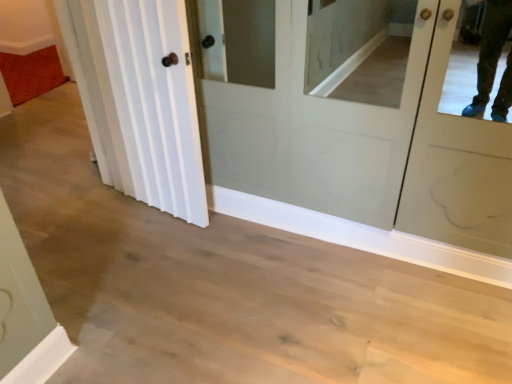
The height and width of the screenshot is (384, 512). What do you see at coordinates (155, 103) in the screenshot? I see `white striped curtain at left` at bounding box center [155, 103].

This screenshot has height=384, width=512. In order to click on white striped curtain at left in this screenshot , I will do `click(155, 103)`.

Locate an element on the screen. The height and width of the screenshot is (384, 512). white striped curtain at left is located at coordinates (155, 103).